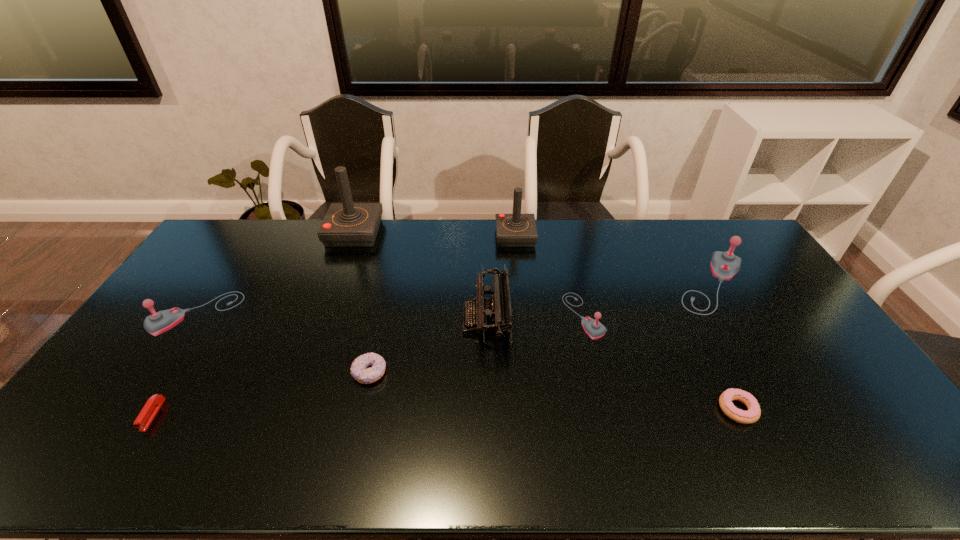
I want to click on vacant space situated 0.070m on the typing side of the typewriter, so click(441, 319).

This screenshot has height=540, width=960. What are the coordinates of `free space located on the typing side of the typewriter` in the screenshot? It's located at (421, 319).

At what (x,y) coordinates should I click in order to perform the action: click on vacant region located on the back of the second biggest gray joystick. Please return your answer as a coordinate pair (x, y). Image resolution: width=960 pixels, height=540 pixels. Looking at the image, I should click on (224, 273).

This screenshot has height=540, width=960. I want to click on free point located on the right of the seventh object from left to right, so click(716, 315).

Where is `free space located on the right of the left doughnut`? The image size is (960, 540). free space located on the right of the left doughnut is located at coordinates (405, 373).

The height and width of the screenshot is (540, 960). In order to click on vacant region located 0.250m on the back of the pink doughnut in this screenshot , I will do `click(695, 324)`.

At what (x,y) coordinates should I click in order to perform the action: click on vacant area situated 0.090m on the front-facing side of the stapler. Please return your answer as a coordinate pair (x, y). Looking at the image, I should click on (119, 468).

You are a GUI agent. You are given a task and a screenshot of the screen. Output one action in this format:
    pyautogui.click(x=<x>, y=<y>)
    Task: Click on the object situated at the left edge
    
    Given the screenshot: What is the action you would take?
    pyautogui.click(x=158, y=322)

Find the location of `object that is at the right edge`. object that is at the right edge is located at coordinates (724, 265).

At what (x,y) coordinates should I click in order to perform the action: click on vacant point at the far edge. Please return your answer as a coordinate pair (x, y). The height and width of the screenshot is (540, 960). Looking at the image, I should click on (626, 243).